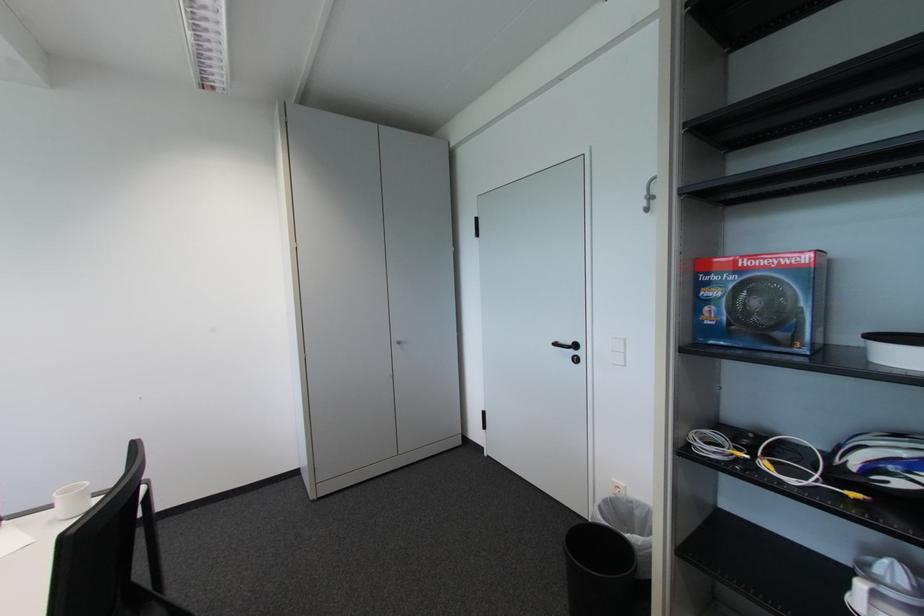
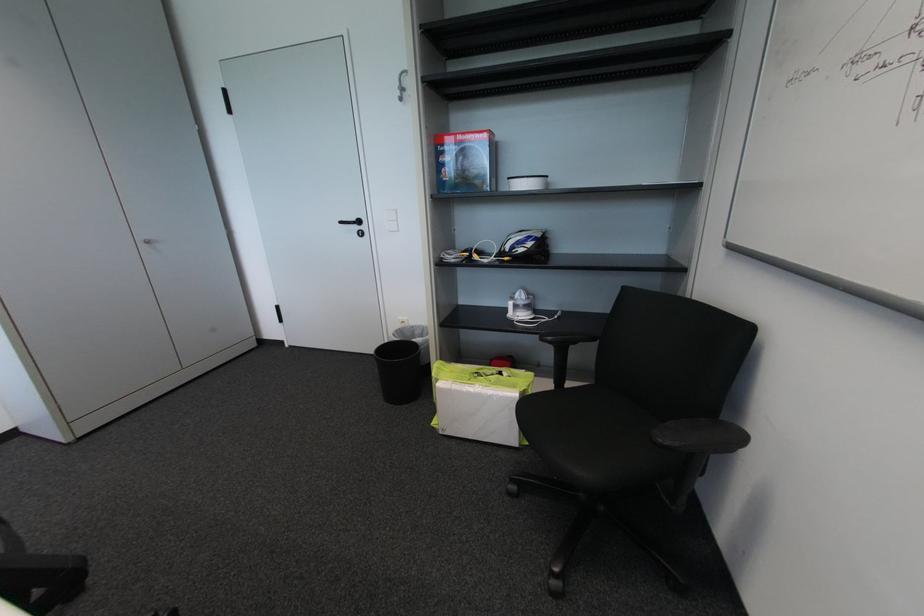
The point at (738, 278) is marked in the first image. Where is the corresponding point in the second image?

(460, 148)